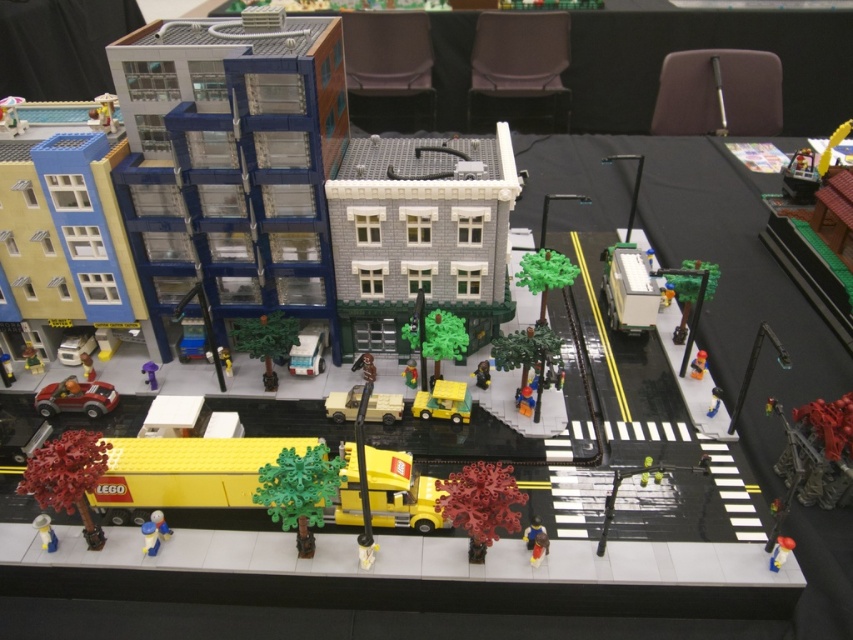
Between point (83, 460) and point (45, 525), which one is positioned behind?

The point (45, 525) is more distant.

Locate an element on the screen. brick red tree at lower left is located at coordinates (68, 476).

Who is more distant from viewer, [61,442] or [90,368]?

The point [90,368] is behind.

Which is in front, point (21, 483) or point (91, 376)?

Point (21, 483)

Does point (68, 458) come closer to viewer compared to point (90, 362)?

Yes, it is in front of point (90, 362).

This screenshot has height=640, width=853. What are the coordinates of `brick red tree at lower left` in the screenshot? It's located at click(68, 476).

Which is in front, point (508, 528) or point (158, 525)?

Point (508, 528) is more forward.

Between point (445, 492) and point (154, 522), which one is positioned in front?

Point (445, 492) is more forward.

At what (x,y) coordinates should I click in order to perform the action: click on rubberized red tree at center. Please return your answer as a coordinate pair (x, y). This screenshot has width=853, height=640. Looking at the image, I should click on (480, 502).